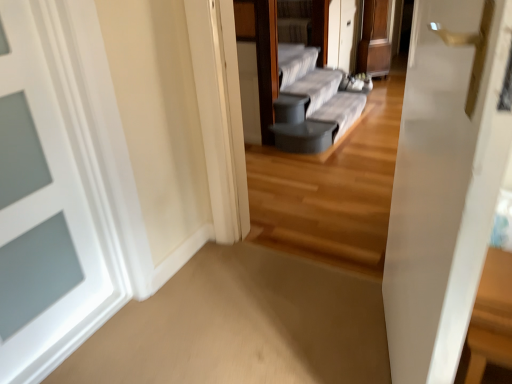
Image resolution: width=512 pixels, height=384 pixels. What do you see at coordinates (52, 189) in the screenshot? I see `white painted wood door at left` at bounding box center [52, 189].

What is the approximate width of wooden table at right?

It is 15.60 inches.

Where is `white painted wood door at left`? This screenshot has height=384, width=512. white painted wood door at left is located at coordinates (52, 189).

Is gray fabric couch at center to the left or to the right of white painted wood door at left in the image?

From the image, it's evident that gray fabric couch at center is to the right of white painted wood door at left.

Can white painted wood door at left be found inside gray fabric couch at center?

Actually, white painted wood door at left is outside gray fabric couch at center.

Is gray fabric couch at center in contact with white painted wood door at left?

No, gray fabric couch at center is not with white painted wood door at left.

Is gray fabric couch at center taller or shorter than white painted wood door at left?

Clearly, gray fabric couch at center is shorter compared to white painted wood door at left.

Find the location of `couch on the left of wooden table at right`. couch on the left of wooden table at right is located at coordinates (315, 87).

Could you tell me if gray fabric couch at center is turned towards wooden table at right?

No, gray fabric couch at center does not turn towards wooden table at right.

From a real-world perspective, does gray fabric couch at center sit lower than wooden table at right?

Incorrect, from a real-world perspective, gray fabric couch at center is higher than wooden table at right.

Do you think wooden table at right is within gray fabric couch at center, or outside of it?

wooden table at right exists outside the volume of gray fabric couch at center.

Are wooden table at right and gray fabric couch at center making contact?

wooden table at right is not next to gray fabric couch at center, and they're not touching.

The height and width of the screenshot is (384, 512). I want to click on couch above the wooden table at right (from a real-world perspective), so click(315, 87).

Is point (498, 309) closer to viewer compared to point (292, 93)?

Yes, it is in front of point (292, 93).

Is white painted wood door at left in front of gray fabric couch at center?

Yes, white painted wood door at left is closer to the camera.

Is white painted wood door at left looking in the opposite direction of gray fabric couch at center?

That's not correct — white painted wood door at left is not looking away from gray fabric couch at center.

In the scene shown: From a real-world perspective, is white painted wood door at left positioned over gray fabric couch at center based on gravity?

Yes, from a real-world perspective, white painted wood door at left is on top of gray fabric couch at center.

Locate an element on the screen. couch on the right of white painted wood door at left is located at coordinates (315, 87).

Is point (21, 202) closer to camera compared to point (478, 312)?

No, (21, 202) is behind (478, 312).

Based on their positions, is white painted wood door at left located to the left or right of wooden table at right?

Clearly, white painted wood door at left is on the left of wooden table at right in the image.

Considering the sizes of white painted wood door at left and wooden table at right in the image, is white painted wood door at left wider or thinner than wooden table at right?

Clearly, white painted wood door at left has less width compared to wooden table at right.

From a real-world perspective, is white painted wood door at left under wooden table at right?

No, from a real-world perspective, white painted wood door at left is not beneath wooden table at right.

In the image, is wooden table at right positioned in front of or behind white painted wood door at left?

Visually, wooden table at right is located behind white painted wood door at left.

Is wooden table at right taller than white painted wood door at left?

No, wooden table at right is not taller than white painted wood door at left.

From the image's perspective, which is below, wooden table at right or white painted wood door at left?

wooden table at right appears lower in the image.

Based on the photo, is wooden table at right wider than white painted wood door at left?

Indeed, wooden table at right has a greater width compared to white painted wood door at left.

Where is `couch on the right of white painted wood door at left`? Image resolution: width=512 pixels, height=384 pixels. couch on the right of white painted wood door at left is located at coordinates (315, 87).

You are a GUI agent. You are given a task and a screenshot of the screen. Output one action in this format:
    pyautogui.click(x=<x>, y=<y>)
    Task: Click on the couch above the wooden table at right (from the image's perspective)
    The width and height of the screenshot is (512, 384).
    Given the screenshot: What is the action you would take?
    pyautogui.click(x=315, y=87)

Estimate the real-world distances between objects in this image. Which object is closer to white painted wood door at left, wooden table at right or gray fabric couch at center?

wooden table at right lies closer to white painted wood door at left than the other object.

Estimate the real-world distances between objects in this image. Which object is further from wooden table at right, white painted wood door at left or gray fabric couch at center?

gray fabric couch at center is positioned further to the anchor wooden table at right.

Based on their spatial positions, is gray fabric couch at center or white painted wood door at left closer to wooden table at right?

white painted wood door at left lies closer to wooden table at right than the other object.

When comparing their distances from gray fabric couch at center, does wooden table at right or white painted wood door at left seem further?

wooden table at right is further to gray fabric couch at center.

When comparing their distances from white painted wood door at left, does gray fabric couch at center or wooden table at right seem closer?

Based on the image, wooden table at right appears to be nearer to white painted wood door at left.

When comparing their distances from gray fabric couch at center, does white painted wood door at left or wooden table at right seem closer?

white painted wood door at left lies closer to gray fabric couch at center than the other object.

Identify the location of table between white painted wood door at left and gray fabric couch at center in the front-back direction. (490, 317).